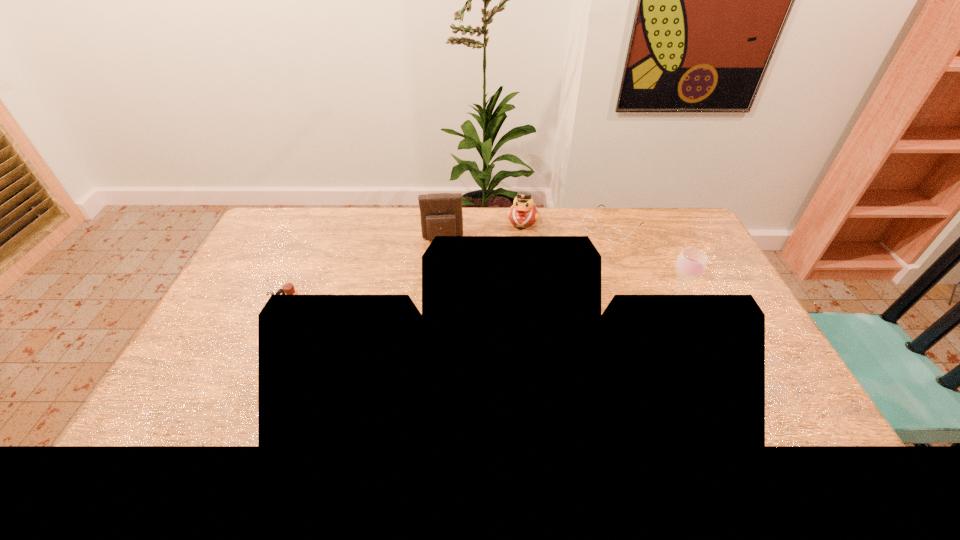
Find the location of `free space on the desktop that is between the leftmost object and the wineglass and is positioned with an open flap on the second object from left to right`. free space on the desktop that is between the leftmost object and the wineglass and is positioned with an open flap on the second object from left to right is located at coordinates (445, 308).

You are a GUI agent. You are given a task and a screenshot of the screen. Output one action in this format:
    pyautogui.click(x=<x>, y=<y>)
    Task: Click on the vacant space on the desktop that is between the Lego and the wineglass and is positioned on the face of the third object from left to right
    Image resolution: width=960 pixels, height=540 pixels.
    Given the screenshot: What is the action you would take?
    pyautogui.click(x=504, y=308)

Locate an element on the screen. Image resolution: width=960 pixels, height=540 pixels. free space on the desktop that is between the leftmost object and the wineglass and is positioned on the front-facing side of the spectacles is located at coordinates (522, 307).